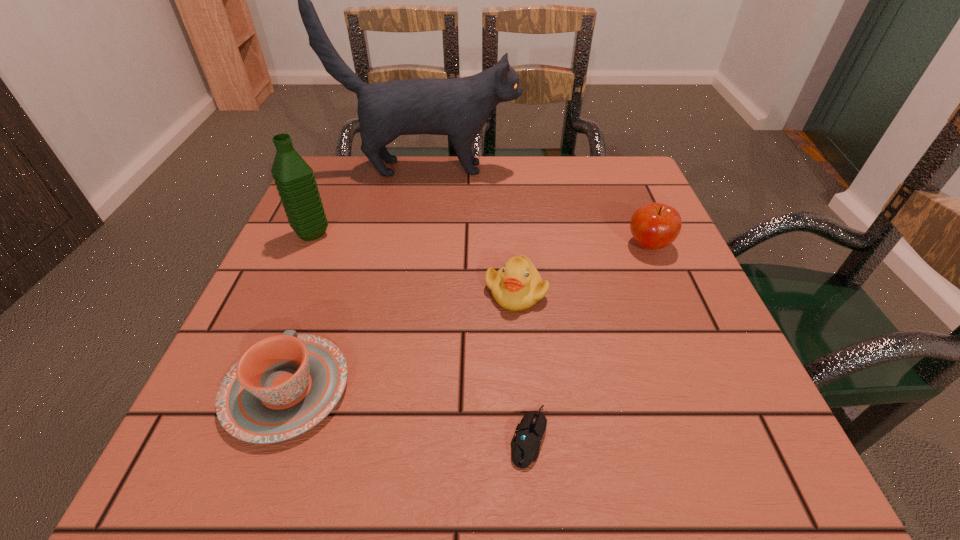
You are a GUI agent. You are given a task and a screenshot of the screen. Output one action in this format:
    pyautogui.click(x=<x>, y=<y>)
    Task: Click on the chinaware that is at the left edge
    This screenshot has width=960, height=540.
    Given the screenshot: What is the action you would take?
    pyautogui.click(x=284, y=385)

This screenshot has height=540, width=960. Identify the location of object present at the right edge. (654, 226).

This screenshot has height=540, width=960. I want to click on object that is at the far left corner, so click(459, 107).

Locate an element on the screen. The image size is (960, 540). object that is at the near left corner is located at coordinates (284, 385).

What are the coordinates of `vacant space at the far edge` in the screenshot? It's located at (418, 197).

I want to click on vacant space at the near edge of the desktop, so point(442,469).

Locate an element on the screen. vacant space at the left edge of the desktop is located at coordinates (280, 299).

The width and height of the screenshot is (960, 540). Identify the location of vacant space at the right edge of the desktop. (657, 300).

In the image, there is a desktop. At what (x,y) coordinates should I click in order to perform the action: click on blank space at the far left corner. Please return your answer as a coordinate pair (x, y). The height and width of the screenshot is (540, 960). Looking at the image, I should click on (374, 169).

The image size is (960, 540). In the image, there is a desktop. Find the location of `free region at the far right corner`. free region at the far right corner is located at coordinates (610, 194).